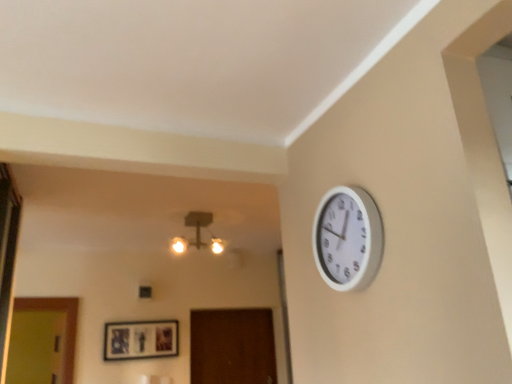
Question: From the image's perspective, is matte glass chandelier at upper center under matte black picture frame at center?

Choices:
 (A) no
 (B) yes

Answer: (A)

Question: Can matte black picture frame at center be found inside matte glass chandelier at upper center?

Choices:
 (A) yes
 (B) no

Answer: (B)

Question: From the image's perspective, is matte glass chandelier at upper center above matte black picture frame at center?

Choices:
 (A) no
 (B) yes

Answer: (B)

Question: Are matte glass chandelier at upper center and matte black picture frame at center located far from each other?

Choices:
 (A) yes
 (B) no

Answer: (B)

Question: Is matte glass chandelier at upper center thinner than matte black picture frame at center?

Choices:
 (A) yes
 (B) no

Answer: (B)

Question: Is matte glass chandelier at upper center taller than matte black picture frame at center?

Choices:
 (A) yes
 (B) no

Answer: (B)

Question: Is matte black picture frame at center to the left of matte glass chandelier at upper center from the viewer's perspective?

Choices:
 (A) no
 (B) yes

Answer: (B)

Question: Considering the relative sizes of matte black picture frame at center and matte glass chandelier at upper center in the image provided, is matte black picture frame at center thinner than matte glass chandelier at upper center?

Choices:
 (A) no
 (B) yes

Answer: (B)

Question: Is matte black picture frame at center beside matte glass chandelier at upper center?

Choices:
 (A) no
 (B) yes

Answer: (A)

Question: From the image's perspective, is matte black picture frame at center located beneath matte glass chandelier at upper center?

Choices:
 (A) yes
 (B) no

Answer: (A)

Question: Can you confirm if matte black picture frame at center is taller than matte glass chandelier at upper center?

Choices:
 (A) yes
 (B) no

Answer: (A)

Question: Considering the relative sizes of matte black picture frame at center and matte glass chandelier at upper center in the image provided, is matte black picture frame at center wider than matte glass chandelier at upper center?

Choices:
 (A) no
 (B) yes

Answer: (A)

Question: Can you confirm if matte black picture frame at center is positioned to the left of white plastic wall clock at upper right?

Choices:
 (A) no
 (B) yes

Answer: (B)